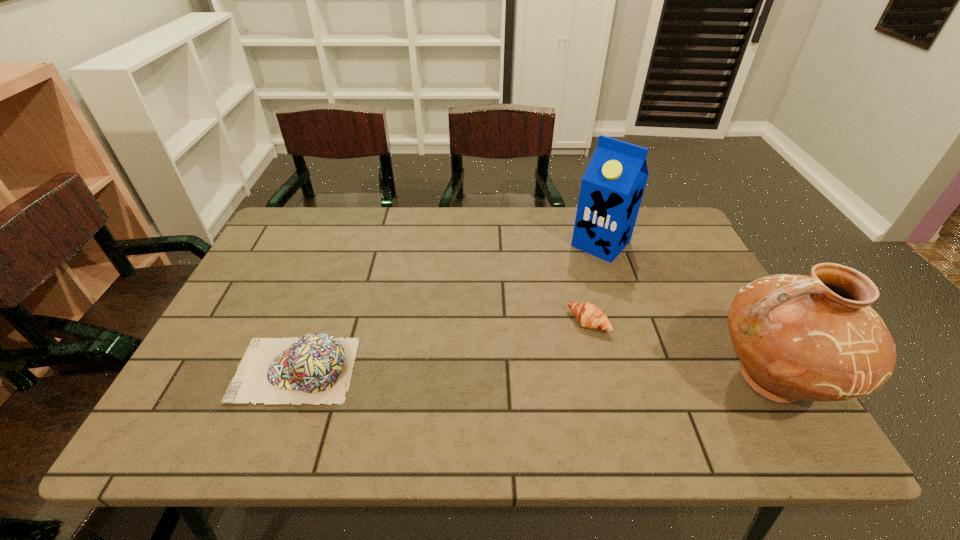
I want to click on empty space between the pottery and the shortest object, so click(x=681, y=351).

What are the coordinates of `vacant space that is in between the cap and the rightmost object` in the screenshot? It's located at (534, 375).

This screenshot has width=960, height=540. What are the coordinates of `unoccupied area between the cap and the rightmost object` in the screenshot? It's located at (534, 375).

Identify the location of vacant space that's between the rightmost object and the farthest object. (686, 312).

Find the location of a particular element. The image size is (960, 540). free space between the pastry and the pottery is located at coordinates (681, 351).

At what (x,y) coordinates should I click in order to perform the action: click on free space that is in between the shortest object and the rightmost object. Please return your answer as a coordinate pair (x, y). This screenshot has width=960, height=540. Looking at the image, I should click on (681, 351).

Where is `free point between the carton and the shortest object`? The height and width of the screenshot is (540, 960). free point between the carton and the shortest object is located at coordinates pos(594,283).

Where is `object that is the second closest to the cap`? object that is the second closest to the cap is located at coordinates (612, 188).

This screenshot has width=960, height=540. Identify the location of object that is the third closest one to the pastry. (317, 368).